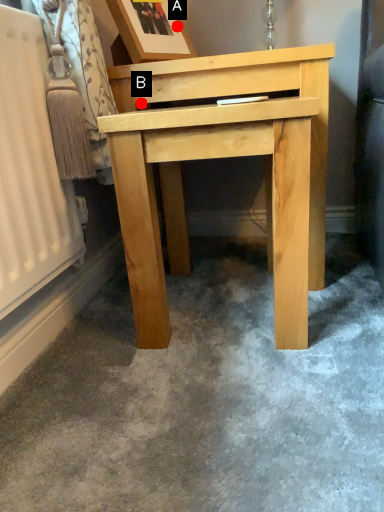
Question: Two points are circled on the image, labeled by A and B beside each circle. Which of the following is the closest to the observer?

Choices:
 (A) A is closer
 (B) B is closer

Answer: (B)